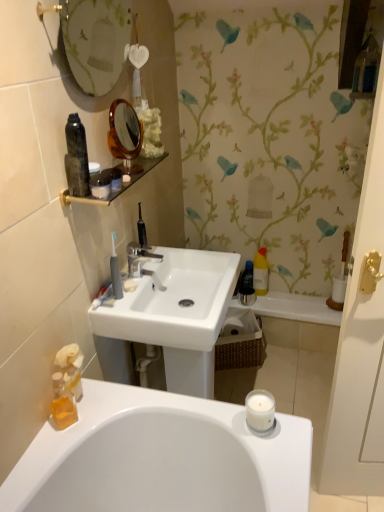
The width and height of the screenshot is (384, 512). I want to click on vacant area that is in front of yellow translucent bottle at right, which is the first bottle in right-to-left order, so click(x=278, y=303).